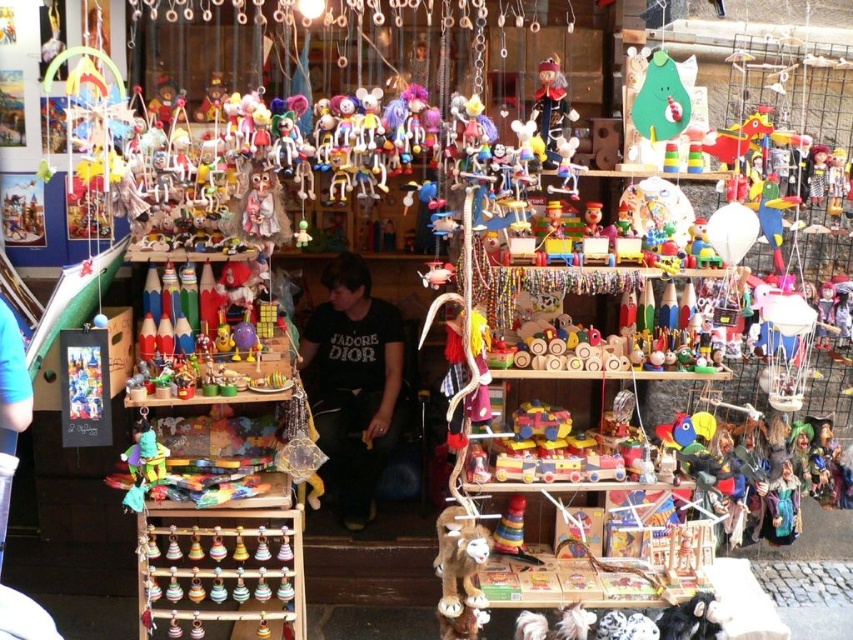
You are a customer in the toy shop and want to place the black cotton shirt at center on top of the brown plush reindeer at lower center. Will the shirt fit entirely on the reindeer?

The black cotton shirt at center is wider than the brown plush reindeer at lower center, so the shirt will not fit entirely on the reindeer.

You are a customer in the toy shop and want to reach both the point at coordinates (308, 355) and the point at coordinates (467, 621). Which point should you approach first to reach the closer one first?

You should approach point (308, 355) first because it is closer to you than point (467, 621), which is further away.